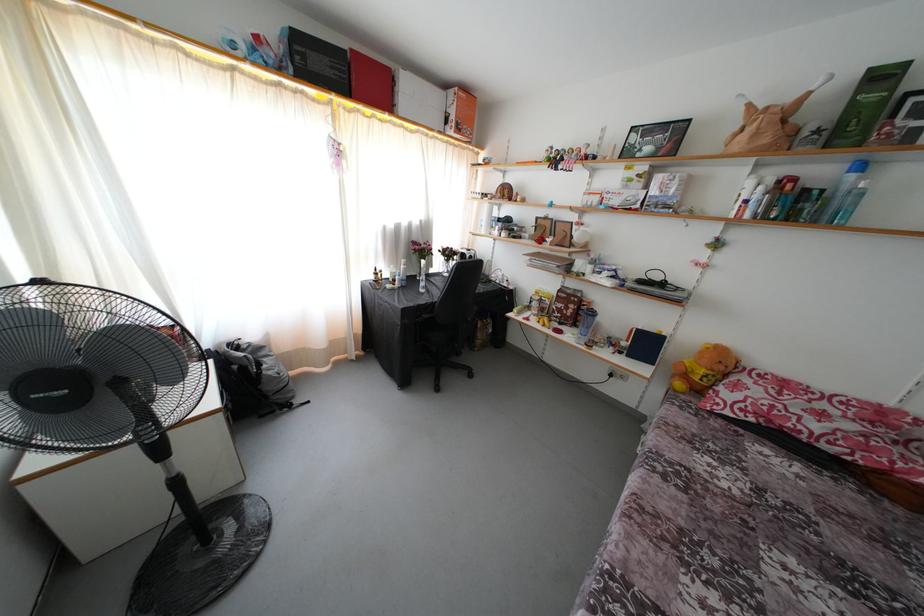
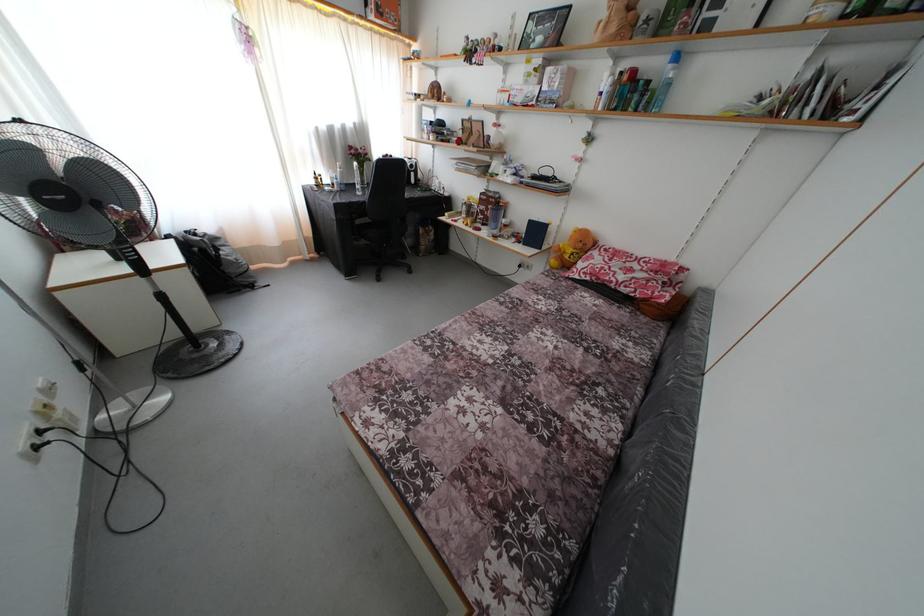
The point at (726, 373) is marked in the first image. Where is the corresponding point in the second image?

(585, 251)